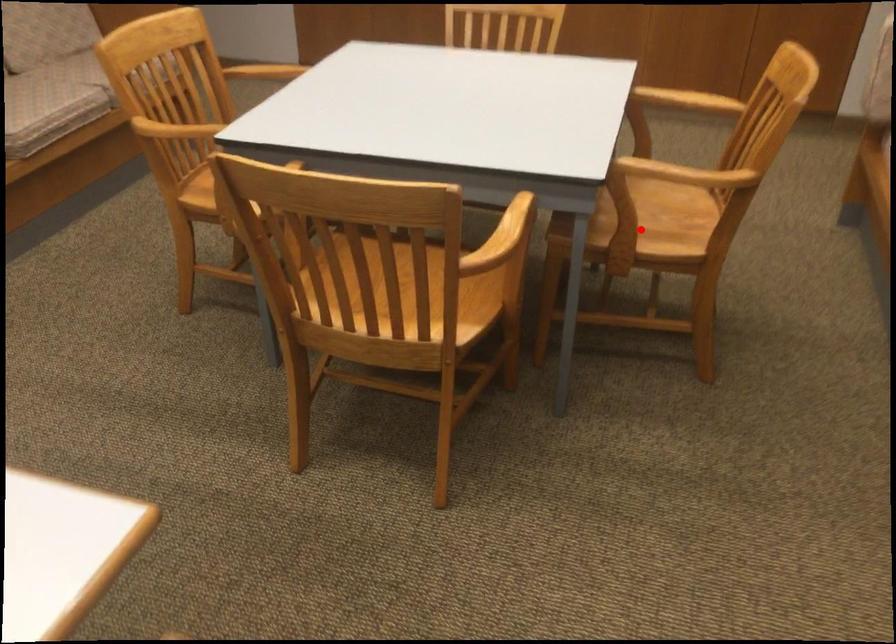
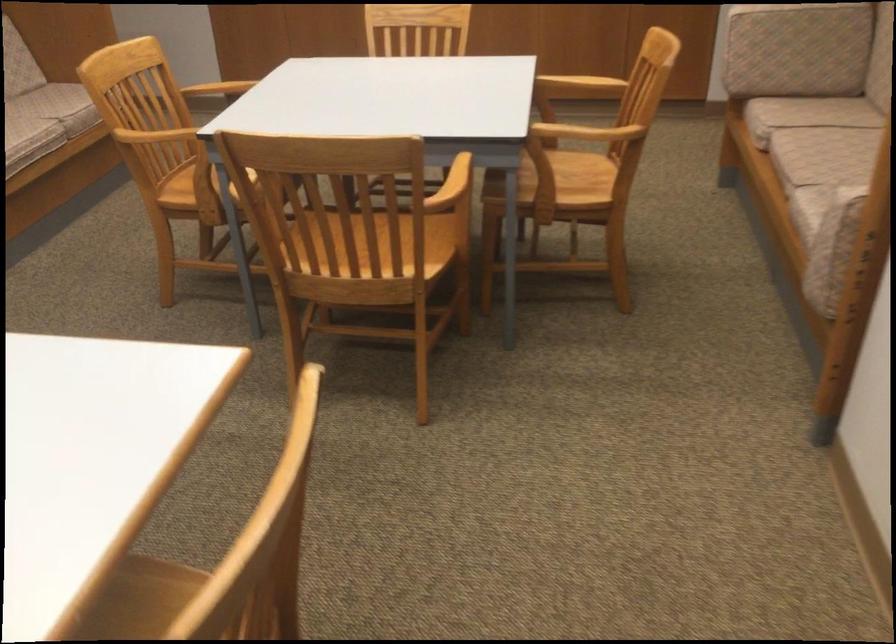
Question: A red point is marked in image1. In image2, is the corresponding 3D point closer to the camera or farther? Reply with the corresponding letter.

Choices:
 (A) The corresponding 3D point is closer.
 (B) The corresponding 3D point is farther.

Answer: (B)